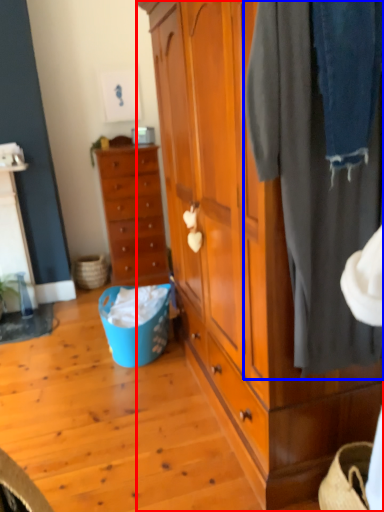
Question: Which of the following is the closest to the observer, cabinetry (highlighted by a red box) or clothing (highlighted by a blue box)?

Choices:
 (A) cabinetry
 (B) clothing

Answer: (A)